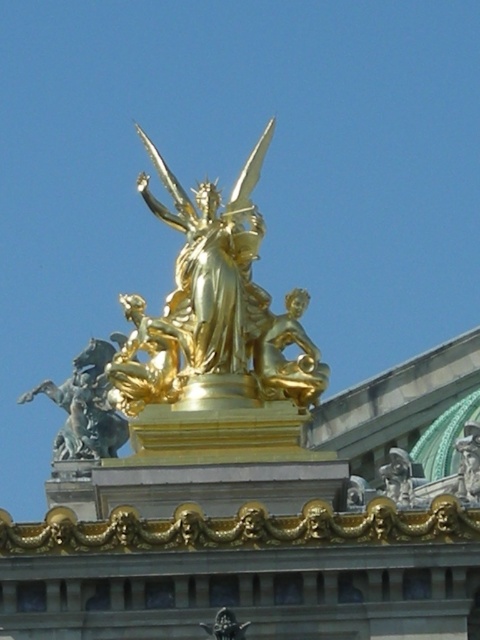
Describe the element at coordinates (84, 406) in the screenshot. The width and height of the screenshot is (480, 640). I see `shiny blue horse at left` at that location.

Who is higher up, shiny blue horse at left or gold metallic sword at center?

shiny blue horse at left is higher up.

Is point (88, 342) positioned in front of point (237, 637)?

No.

Where is `shiny blue horse at left`? shiny blue horse at left is located at coordinates (84, 406).

Can you confirm if shiny blue horse at left is wider than gold polished statue at center?

Yes.

Does point (124, 428) come behind point (320, 365)?

Yes, it is behind point (320, 365).

What are the coordinates of `shiny blue horse at left` in the screenshot? It's located at (84, 406).

Does gold polished statue at center have a smaller size compared to gold metallic sword at center?

Incorrect, gold polished statue at center is not smaller in size than gold metallic sword at center.

Does gold polished statue at center have a greater height compared to gold metallic sword at center?

Yes, gold polished statue at center is taller than gold metallic sword at center.

What do you see at coordinates (284, 355) in the screenshot?
I see `gold polished statue at center` at bounding box center [284, 355].

This screenshot has width=480, height=640. I want to click on gold polished statue at center, so click(x=284, y=355).